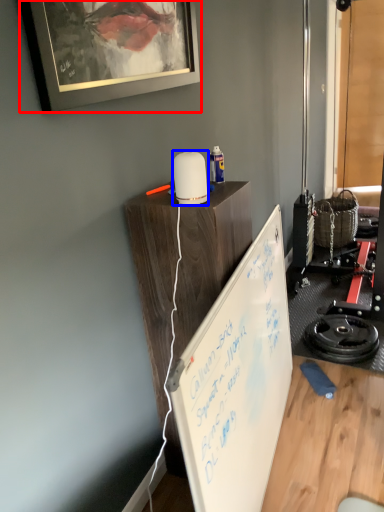
Question: Which object is closer to the camera taking this photo, picture frame (highlighted by a red box) or appliance (highlighted by a blue box)?

Choices:
 (A) picture frame
 (B) appliance

Answer: (A)